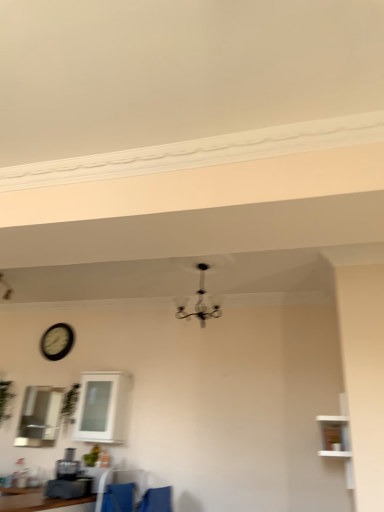
The height and width of the screenshot is (512, 384). What do you see at coordinates (118, 498) in the screenshot?
I see `blue fabric feeding chair at lower center` at bounding box center [118, 498].

Where is `blue fabric armchair at lower center`? This screenshot has width=384, height=512. blue fabric armchair at lower center is located at coordinates (156, 500).

Measure the distance between point (347, 423) and camera.

They are 3.56 meters apart.

What do you see at coordinates (5, 400) in the screenshot? This screenshot has height=512, width=384. I see `green leafy plant at left, the 2th plant when ordered from right to left` at bounding box center [5, 400].

At what (x,y) coordinates should I click in order to perform the action: click on green leafy plant at center, which appears as the second plant when viewed from the left. Please return your answer as a coordinate pair (x, y). Image resolution: width=384 pixels, height=512 pixels. Looking at the image, I should click on pyautogui.click(x=69, y=406).

The height and width of the screenshot is (512, 384). What do you see at coordinates (102, 407) in the screenshot? I see `white glossy cabinet at center, which ranks as the 1th window in right-to-left order` at bounding box center [102, 407].

I want to click on blue fabric feeding chair at lower center, so click(x=118, y=498).

Does blue fabric armchair at lower center come in front of wooden clock at upper left?

Yes, blue fabric armchair at lower center is closer to the camera.

Considering the relative sizes of blue fabric armchair at lower center and wooden clock at upper left in the image provided, is blue fabric armchair at lower center taller than wooden clock at upper left?

No.

How many degrees apart are the facing directions of blue fabric armchair at lower center and wooden clock at upper left?

There is a 87-degree angle between the facing directions of blue fabric armchair at lower center and wooden clock at upper left.

This screenshot has width=384, height=512. What are the coordinates of `armchair beneath the wooden clock at upper left (from a real-world perspective)` in the screenshot? It's located at (156, 500).

From the image's perspective, is blue fabric armchair at lower center above or below white glossy cabinet at center, which ranks as the 1th window in right-to-left order?

Clearly, from the image's perspective, blue fabric armchair at lower center is below white glossy cabinet at center, which ranks as the 1th window in right-to-left order.

Considering the sizes of objects blue fabric armchair at lower center and white glossy cabinet at center, which ranks as the 1th window in right-to-left order, in the image provided, who is smaller, blue fabric armchair at lower center or white glossy cabinet at center, which ranks as the 1th window in right-to-left order,?

With smaller size is blue fabric armchair at lower center.

Can you confirm if blue fabric armchair at lower center is taller than white glossy cabinet at center, which ranks as the 1th window in right-to-left order?

Incorrect, the height of blue fabric armchair at lower center is not larger of that of white glossy cabinet at center, which ranks as the 1th window in right-to-left order.

Is blue fabric armchair at lower center inside or outside of white glossy cabinet at center, which ranks as the 2th window in left-to-right order?

blue fabric armchair at lower center is located beyond the bounds of white glossy cabinet at center, which ranks as the 2th window in left-to-right order.

Is wooden clock at upper left positioned far away from black glass chandelier at center?

That's right, there is a large distance between wooden clock at upper left and black glass chandelier at center.

Which of these two, wooden clock at upper left or black glass chandelier at center, is smaller?

wooden clock at upper left.

Which of these two, wooden clock at upper left or black glass chandelier at center, is wider?

Wider between the two is black glass chandelier at center.

From a real-world perspective, is wooden clock at upper left on top of black glass chandelier at center?

No, from a real-world perspective, wooden clock at upper left is not over black glass chandelier at center

Does point (54, 400) lie in front of point (102, 429)?

That is False.

What's the angular difference between clear glass cabinet at upper left, positioned as the first window in left-to-right order, and white glossy cabinet at center, which ranks as the 2th window in left-to-right order,'s facing directions?

There is a 0.000119-degree angle between the facing directions of clear glass cabinet at upper left, positioned as the first window in left-to-right order, and white glossy cabinet at center, which ranks as the 2th window in left-to-right order.

Locate an element on the screen. Image resolution: width=384 pixels, height=512 pixels. window behind the white glossy cabinet at center, which ranks as the 1th window in right-to-left order is located at coordinates (39, 417).

From the image's perspective, which one is positioned higher, clear glass cabinet at upper left, which appears as the second window when viewed from the right, or white glossy cabinet at center, which ranks as the 2th window in left-to-right order?

white glossy cabinet at center, which ranks as the 2th window in left-to-right order, is shown above in the image.

Is green leafy plant at left, marked as the first plant in a left-to-right arrangement, further to camera compared to white wooden shelf at right?

Yes.

Consider the image. Is green leafy plant at left, marked as the first plant in a left-to-right arrangement, wider or thinner than white wooden shelf at right?

green leafy plant at left, marked as the first plant in a left-to-right arrangement, is thinner than white wooden shelf at right.

From a real-world perspective, is green leafy plant at left, the 2th plant when ordered from right to left, below white wooden shelf at right?

No.

Which point is more forward, (11, 382) or (351, 476)?

The point (351, 476) is closer.

Is the surface of clear glass cabinet at upper left, which appears as the second window when viewed from the right, in direct contact with green leafy plant at center, positioned as the 1th plant in right-to-left order?

No, clear glass cabinet at upper left, which appears as the second window when viewed from the right, is not making contact with green leafy plant at center, positioned as the 1th plant in right-to-left order.

Which is in front, point (36, 440) or point (74, 396)?

Point (36, 440)

Which of these two, clear glass cabinet at upper left, which appears as the second window when viewed from the right, or green leafy plant at center, positioned as the 1th plant in right-to-left order, is smaller?

clear glass cabinet at upper left, which appears as the second window when viewed from the right.

Is blue fabric feeding chair at lower center oriented away from wooden clock at upper left?

That's not correct — blue fabric feeding chair at lower center is not looking away from wooden clock at upper left.

From the image's perspective, is blue fabric feeding chair at lower center above wooden clock at upper left?

No.

In the scene shown: Is blue fabric feeding chair at lower center thinner than wooden clock at upper left?

In fact, blue fabric feeding chair at lower center might be wider than wooden clock at upper left.

Does blue fabric feeding chair at lower center touch wooden clock at upper left?

No, blue fabric feeding chair at lower center is not beside wooden clock at upper left.

Locate an element on the screen. The image size is (384, 512). clock above the blue fabric armchair at lower center (from the image's perspective) is located at coordinates (57, 341).

Where is `armchair located below the white glossy cabinet at center, which ranks as the 2th window in left-to-right order (from the image's perspective)`? This screenshot has height=512, width=384. armchair located below the white glossy cabinet at center, which ranks as the 2th window in left-to-right order (from the image's perspective) is located at coordinates (156, 500).

Estimate the real-world distances between objects in this image. Which object is closer to blue fabric armchair at lower center, blue fabric feeding chair at lower center or white glossy cabinet at center, which ranks as the 2th window in left-to-right order?

The object closer to blue fabric armchair at lower center is blue fabric feeding chair at lower center.

Estimate the real-world distances between objects in this image. Which object is further from green leafy plant at left, the 2th plant when ordered from right to left, white glossy cabinet at center, which ranks as the 2th window in left-to-right order, or green leafy plant at center, which appears as the second plant when viewed from the left?

white glossy cabinet at center, which ranks as the 2th window in left-to-right order, lies further to green leafy plant at left, the 2th plant when ordered from right to left, than the other object.

Which object lies nearer to the anchor point wooden clock at upper left, green leafy plant at center, which appears as the second plant when viewed from the left, or black glass chandelier at center?

The object closer to wooden clock at upper left is green leafy plant at center, which appears as the second plant when viewed from the left.

When comparing their distances from wooden clock at upper left, does matte black coffee machine at lower left or black glass chandelier at center seem further?

black glass chandelier at center.

Which object lies further to the anchor point blue fabric feeding chair at lower center, blue fabric armchair at lower center or clear glass cabinet at upper left, positioned as the first window in left-to-right order?

clear glass cabinet at upper left, positioned as the first window in left-to-right order, is positioned further to the anchor blue fabric feeding chair at lower center.

Based on their spatial positions, is white glossy cabinet at center, which ranks as the 1th window in right-to-left order, or wooden clock at upper left closer to blue fabric feeding chair at lower center?

white glossy cabinet at center, which ranks as the 1th window in right-to-left order, is positioned closer to the anchor blue fabric feeding chair at lower center.

When comparing their distances from white wooden shelf at right, does matte black coffee machine at lower left or wooden clock at upper left seem closer?

matte black coffee machine at lower left lies closer to white wooden shelf at right than the other object.

In the scene shown: Estimate the real-world distances between objects in this image. Which object is closer to blue fabric feeding chair at lower center, white wooden shelf at right or green leafy plant at center, which appears as the second plant when viewed from the left?

green leafy plant at center, which appears as the second plant when viewed from the left, lies closer to blue fabric feeding chair at lower center than the other object.

This screenshot has width=384, height=512. In order to click on coffee machine situated between clear glass cabinet at upper left, which appears as the second window when viewed from the right, and white wooden shelf at right from left to right in this screenshot , I will do `click(68, 479)`.

Locate an element on the screen. The image size is (384, 512). clock between clear glass cabinet at upper left, which appears as the second window when viewed from the right, and black glass chandelier at center from left to right is located at coordinates 57,341.

You are a GUI agent. You are given a task and a screenshot of the screen. Output one action in this format:
    pyautogui.click(x=<x>, y=<y>)
    Task: Click on the coffee machine positioned between blue fabric armchair at lower center and wooden clock at upper left from near to far
    
    Given the screenshot: What is the action you would take?
    point(68,479)

The height and width of the screenshot is (512, 384). I want to click on coffee machine between green leafy plant at left, marked as the first plant in a left-to-right arrangement, and white wooden shelf at right from left to right, so click(68, 479).